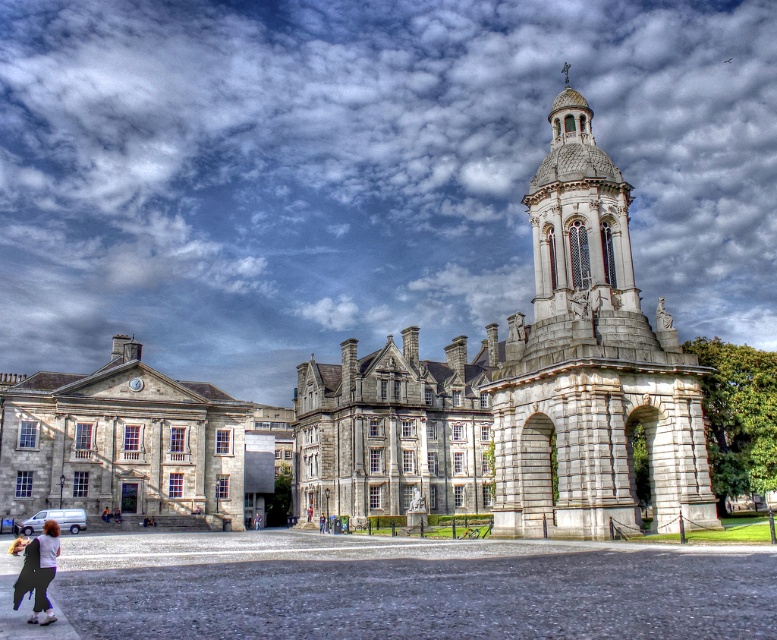
Question: Considering the relative positions of white stone tower at center-right and matte white shirt at lower left in the image provided, where is white stone tower at center-right located with respect to matte white shirt at lower left?

Choices:
 (A) right
 (B) left

Answer: (A)

Question: Which point is closer to the camera?

Choices:
 (A) (49, 552)
 (B) (646, 346)

Answer: (A)

Question: Is white stone tower at center-right to the left of matte white shirt at lower left from the viewer's perspective?

Choices:
 (A) yes
 (B) no

Answer: (B)

Question: Does white stone tower at center-right lie behind matte white shirt at lower left?

Choices:
 (A) no
 (B) yes

Answer: (B)

Question: Which point is farther to the camera?

Choices:
 (A) (563, 140)
 (B) (37, 605)

Answer: (A)